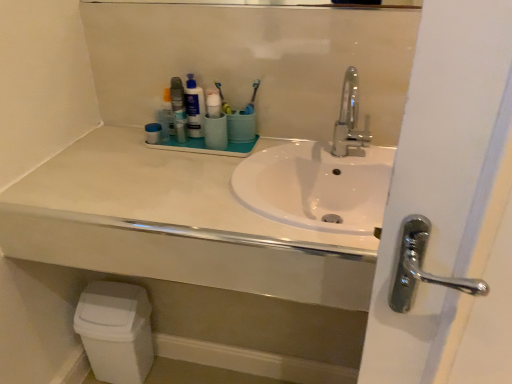
This screenshot has width=512, height=384. In order to click on vacant space that is to the left of polished chrome faucet at center in this screenshot , I will do `click(300, 163)`.